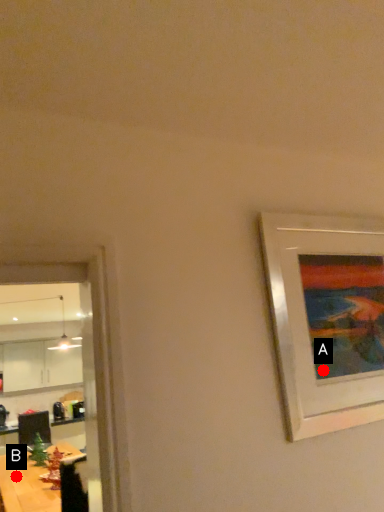
Question: Two points are circled on the image, labeled by A and B beside each circle. Among these points, which one is nearest to the camera?

Choices:
 (A) A is closer
 (B) B is closer

Answer: (A)